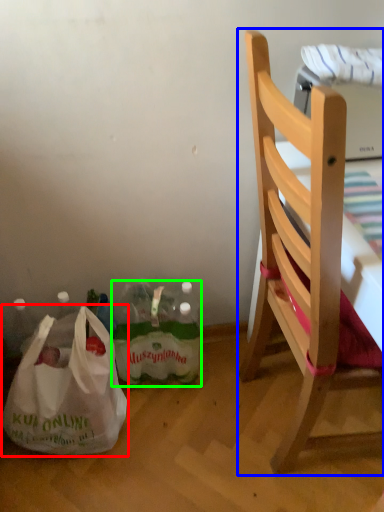
Question: Estimate the real-world distances between objects in this image. Which object is closer to plastic bag (highlighted by a red box), chair (highlighted by a blue box) or bottle (highlighted by a green box)?

Choices:
 (A) chair
 (B) bottle

Answer: (B)